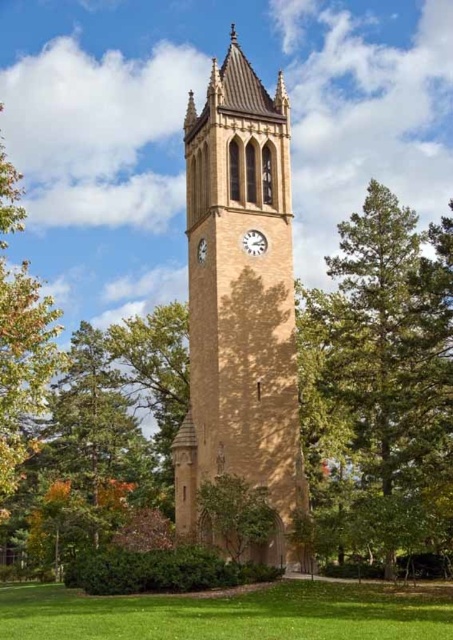
You are standing in front of the clock tower and notice the green grass at lower center and the green leafy tree at left. Which one is more to the left?

The green leafy tree at left is more to the left.

You are a photographer standing at the base of the yellow stone clock tower at center and want to capture a wide shot of the green grass at lower center. Since the tower is in the way, you need to move sideways. Which direction should you move to ensure the tower doesn t block the grass in your photo?

The yellow stone clock tower at center has a lesser width compared to green grass at lower center, so you should move sideways to either the left or right of the tower to avoid blocking the view of the green grass at lower center.

You are standing in front of the clock tower and want to take a photo of the clock face. There is a green leafy tree at right in the way. Based on the tree position, will the tree block your view of the clock face?

The green leafy tree at right is located at coordinates (382, 384), which is to the right and above the midpoint of the image. Since the clock face is at the midpoint of the tower, the tree is positioned to the right and higher up, so it might not block the view of the clock face unless the tree branches extend towards the center. However, based on the given coordinates alone, the tree is likely positioned to the side and above the clock, so it might not obstruct the view directly.